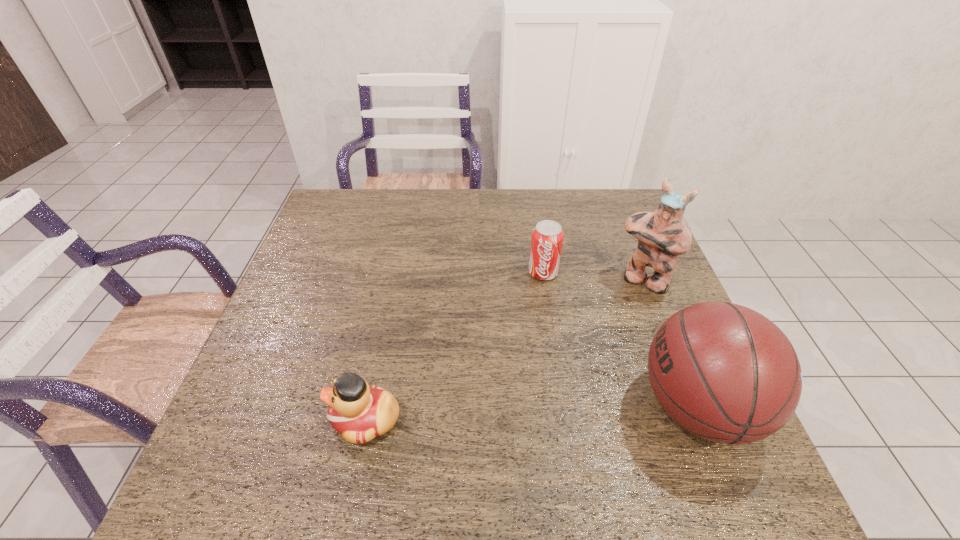
Identify the location of free region at the far edge. (403, 217).

Where is `vacant space at the near edge of the desktop`? This screenshot has height=540, width=960. vacant space at the near edge of the desktop is located at coordinates (412, 442).

Where is `free space at the left edge of the desktop`? The image size is (960, 540). free space at the left edge of the desktop is located at coordinates coord(298,327).

This screenshot has height=540, width=960. Identify the location of vacant area at the right edge. (632, 346).

The image size is (960, 540). Identify the location of free point at the far left corner. (326, 225).

Find the location of a particular element. This screenshot has height=540, width=960. vacant area between the second tallest object and the leftmost object is located at coordinates (532, 413).

This screenshot has width=960, height=540. What are the coordinates of `vacant space that is in between the tallest object and the leftmost object` in the screenshot? It's located at (504, 349).

The height and width of the screenshot is (540, 960). What are the coordinates of `unoccupied position between the soda can and the tallest object` in the screenshot? It's located at click(593, 276).

You are a GUI agent. You are given a task and a screenshot of the screen. Output one action in this format:
    pyautogui.click(x=<x>, y=<y>)
    Task: Click on the empty location between the soda can and the third shortest object
    The width and height of the screenshot is (960, 540).
    Given the screenshot: What is the action you would take?
    pyautogui.click(x=620, y=340)

Locate an element on the screen. empty location between the shortest object and the soda can is located at coordinates (454, 346).